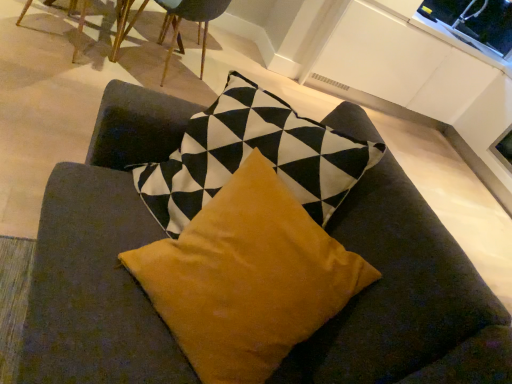
Question: Is wooden chair at upper center, marked as the 2th chair in a left-to-right arrangement, smaller than transparent glass window screen at upper right?

Choices:
 (A) no
 (B) yes

Answer: (A)

Question: From a real-world perspective, is wooden chair at upper center, the 1th chair in the right-to-left sequence, over transparent glass window screen at upper right?

Choices:
 (A) yes
 (B) no

Answer: (B)

Question: Can you confirm if wooden chair at upper center, marked as the 2th chair in a left-to-right arrangement, is shorter than transparent glass window screen at upper right?

Choices:
 (A) yes
 (B) no

Answer: (B)

Question: Can you see wooden chair at upper center, the 1th chair in the right-to-left sequence, touching transparent glass window screen at upper right?

Choices:
 (A) no
 (B) yes

Answer: (A)

Question: Is wooden chair at upper center, the 1th chair in the right-to-left sequence, not close to transparent glass window screen at upper right?

Choices:
 (A) yes
 (B) no

Answer: (A)

Question: Does wooden chair at upper center, the 1th chair in the right-to-left sequence, have a larger size compared to transparent glass window screen at upper right?

Choices:
 (A) yes
 (B) no

Answer: (A)

Question: Considering the relative sizes of mustard velvet pillow at center and wooden chair at upper center, the 1th chair in the right-to-left sequence, in the image provided, is mustard velvet pillow at center bigger than wooden chair at upper center, the 1th chair in the right-to-left sequence,?

Choices:
 (A) no
 (B) yes

Answer: (A)

Question: Is mustard velvet pillow at center wider than wooden chair at upper center, the 1th chair in the right-to-left sequence?

Choices:
 (A) yes
 (B) no

Answer: (B)

Question: Can you confirm if mustard velvet pillow at center is smaller than wooden chair at upper center, marked as the 2th chair in a left-to-right arrangement?

Choices:
 (A) yes
 (B) no

Answer: (A)

Question: Is mustard velvet pillow at center shorter than wooden chair at upper center, marked as the 2th chair in a left-to-right arrangement?

Choices:
 (A) no
 (B) yes

Answer: (B)

Question: Is mustard velvet pillow at center looking in the opposite direction of wooden chair at upper center, the 1th chair in the right-to-left sequence?

Choices:
 (A) no
 (B) yes

Answer: (A)

Question: From the image's perspective, would you say mustard velvet pillow at center is shown under wooden chair at upper center, the 1th chair in the right-to-left sequence?

Choices:
 (A) yes
 (B) no

Answer: (A)

Question: From the image's perspective, is transparent glass window screen at upper right on wooden chair at upper left, the second chair positioned from the right?

Choices:
 (A) no
 (B) yes

Answer: (A)